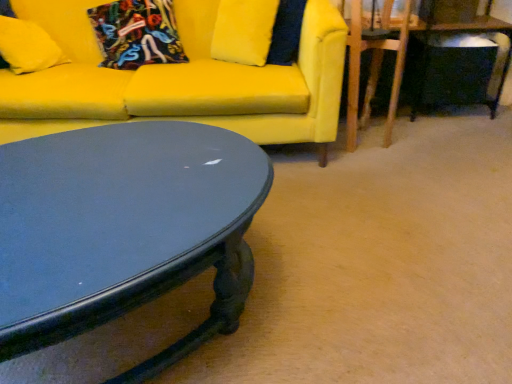
Identify the location of empty space that is to the right of wooden swivel chair at right. Image resolution: width=512 pixels, height=384 pixels. (410, 138).